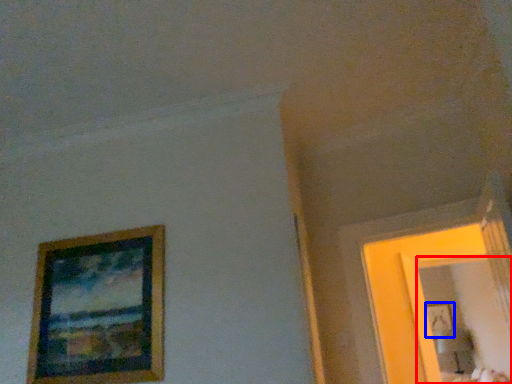
Question: Among these objects, which one is farthest to the camera, mirror (highlighted by a red box) or picture frame (highlighted by a blue box)?

Choices:
 (A) mirror
 (B) picture frame

Answer: (B)